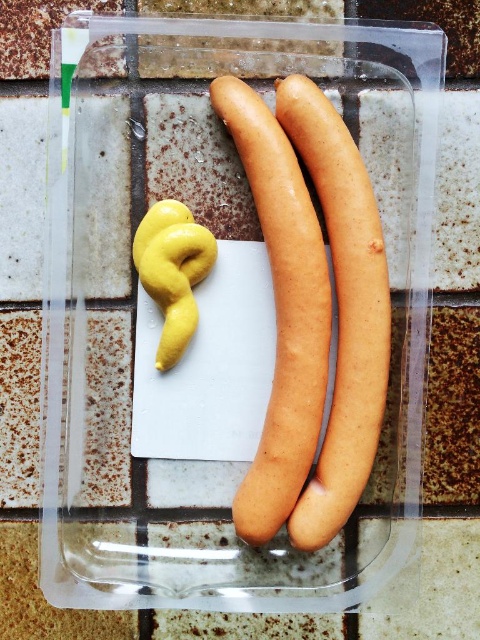
Is smooth beige sausage at center below smooth beige hot dog at center?

No, smooth beige sausage at center is not below smooth beige hot dog at center.

Between smooth beige sausage at center and smooth beige hot dog at center, which one appears on the right side from the viewer's perspective?

Positioned to the right is smooth beige hot dog at center.

Is point (324, 540) farther from camera compared to point (364, 314)?

No, (324, 540) is closer to viewer.

At what (x,y) coordinates should I click in order to perform the action: click on smooth beige sausage at center. Please return your answer as a coordinate pair (x, y). The image size is (480, 640). Looking at the image, I should click on (282, 310).